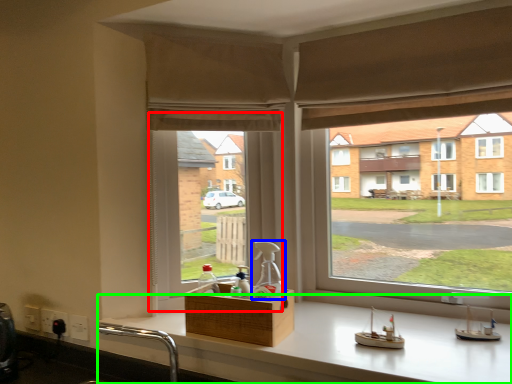
Question: Considering the real-world distances, which object is farthest from window screen (highlighted by a red box)? bottle (highlighted by a blue box) or counter (highlighted by a green box)?

Choices:
 (A) bottle
 (B) counter

Answer: (B)